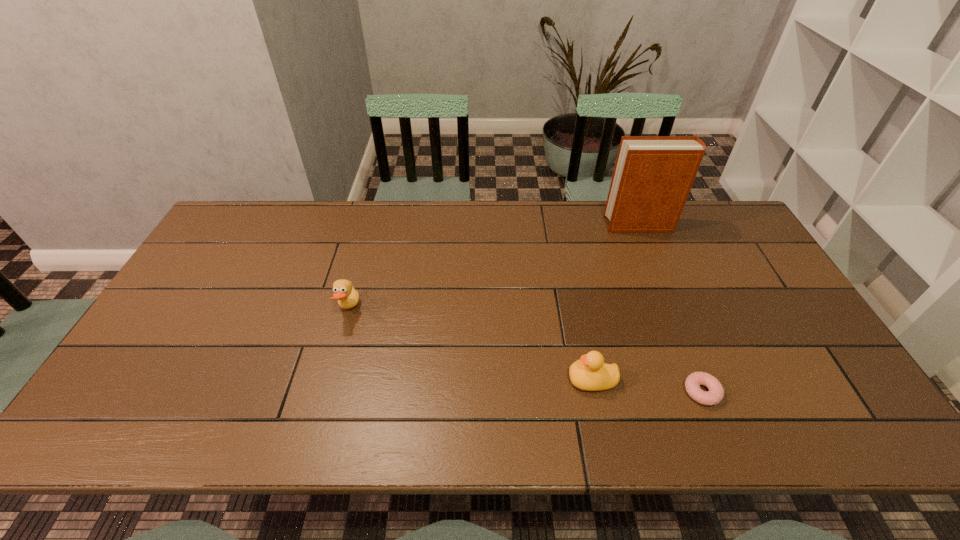
Locate an element on the screen. The height and width of the screenshot is (540, 960). the farthest object is located at coordinates (653, 175).

Identify the location of hardback book. (653, 175).

At what (x,y) coordinates should I click in order to perform the action: click on the leftmost object. Please return your answer as a coordinate pair (x, y). This screenshot has height=540, width=960. Looking at the image, I should click on (345, 293).

Find the location of a particular element. Image resolution: width=960 pixels, height=540 pixels. the farther duck is located at coordinates (345, 293).

Locate an element on the screen. This screenshot has width=960, height=540. the nearer duck is located at coordinates [590, 373].

Where is `the second object from left to right`? the second object from left to right is located at coordinates (590, 373).

Where is `the shortest object`? the shortest object is located at coordinates (715, 395).

The width and height of the screenshot is (960, 540). I want to click on free space located 0.050m on the open cover of the farthest object, so click(590, 225).

Where is `vacant area situated on the open cover of the farthest object`? The image size is (960, 540). vacant area situated on the open cover of the farthest object is located at coordinates (561, 225).

You are a GUI agent. You are given a task and a screenshot of the screen. Output one action in this format:
    pyautogui.click(x=<x>, y=<y>)
    Task: Click on the vacant space located 0.080m on the open cover of the farthest object
    The height and width of the screenshot is (540, 960).
    Given the screenshot: What is the action you would take?
    pyautogui.click(x=582, y=225)